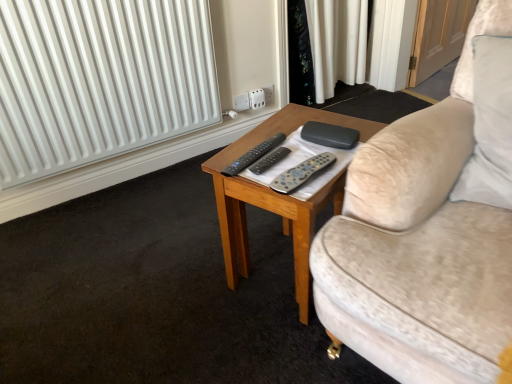
The height and width of the screenshot is (384, 512). Find the location of `vacant space behind black plastic remote control at center, which is counted as the 2th remote control, starting from the right`. vacant space behind black plastic remote control at center, which is counted as the 2th remote control, starting from the right is located at coordinates [x=270, y=135].